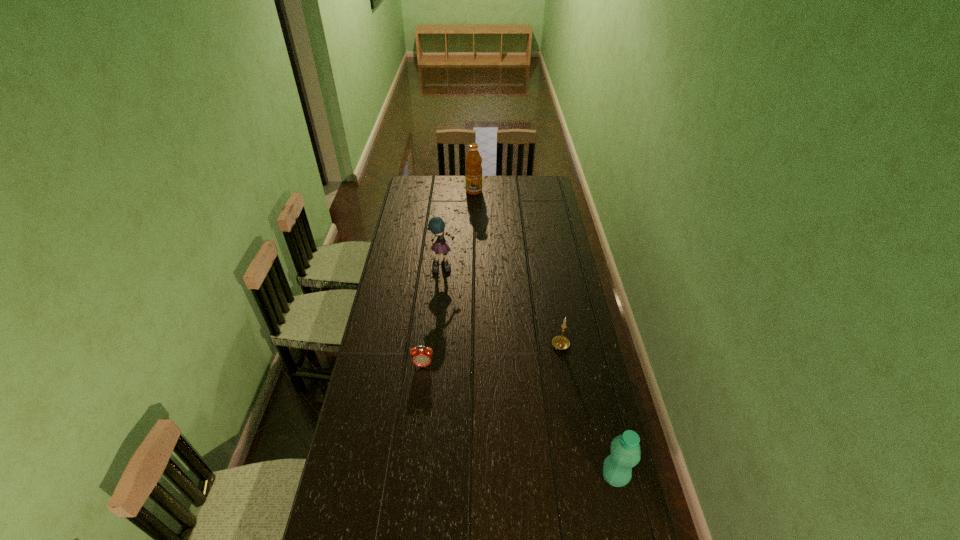
This screenshot has height=540, width=960. In order to click on object that is at the far edge in this screenshot , I will do `click(473, 171)`.

Identify the location of bottle that is at the right edge. This screenshot has width=960, height=540. (625, 450).

This screenshot has height=540, width=960. In order to click on candle holder present at the right edge in this screenshot , I will do `click(560, 342)`.

At what (x,y) coordinates should I click in order to perform the action: click on free space at the near edge of the desktop. Please return your answer as a coordinate pair (x, y). Looking at the image, I should click on (519, 523).

Locate an element on the screen. blank space at the left edge is located at coordinates (393, 265).

Locate an element on the screen. blank space at the right edge is located at coordinates (569, 261).

In the image, there is a desktop. At what (x,y) coordinates should I click in order to perform the action: click on vacant space at the far right corner. Please return your answer as a coordinate pair (x, y). Image resolution: width=960 pixels, height=540 pixels. Looking at the image, I should click on (551, 186).

Image resolution: width=960 pixels, height=540 pixels. Identify the location of free space that is in between the fourth nearest object and the rightmost object. (530, 372).

This screenshot has width=960, height=540. I want to click on empty space that is in between the third object from right to left and the shortest object, so click(x=448, y=278).

Locate an element on the screen. This screenshot has width=960, height=540. vacant area that lies between the second shortest object and the fourth nearest object is located at coordinates [503, 307].